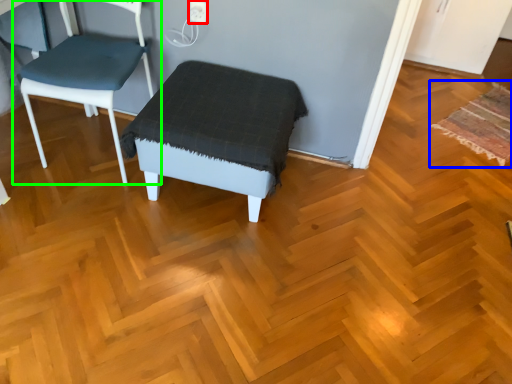
Question: Which is farther away from electric outlet (highlighted by a red box)? mat (highlighted by a blue box) or chair (highlighted by a green box)?

Choices:
 (A) mat
 (B) chair

Answer: (A)